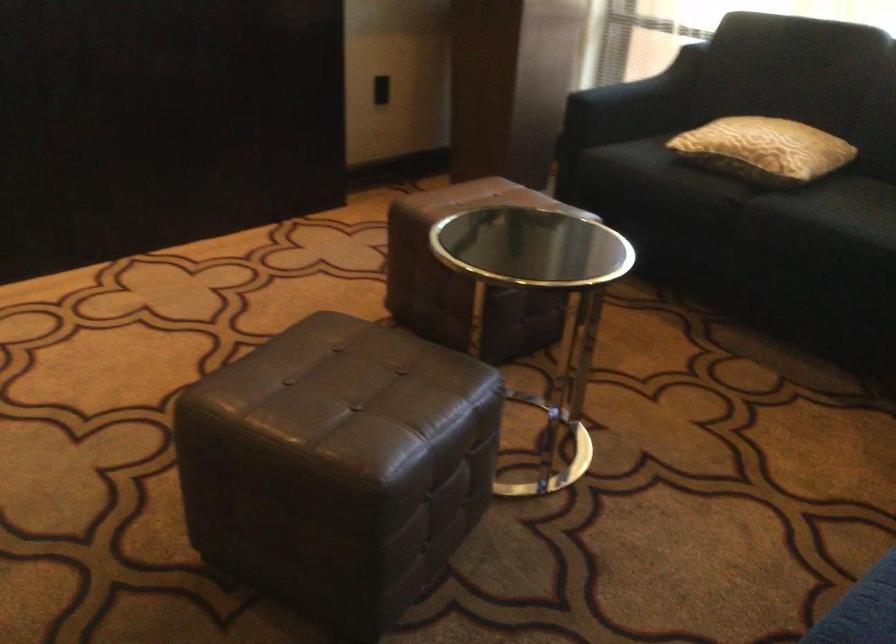
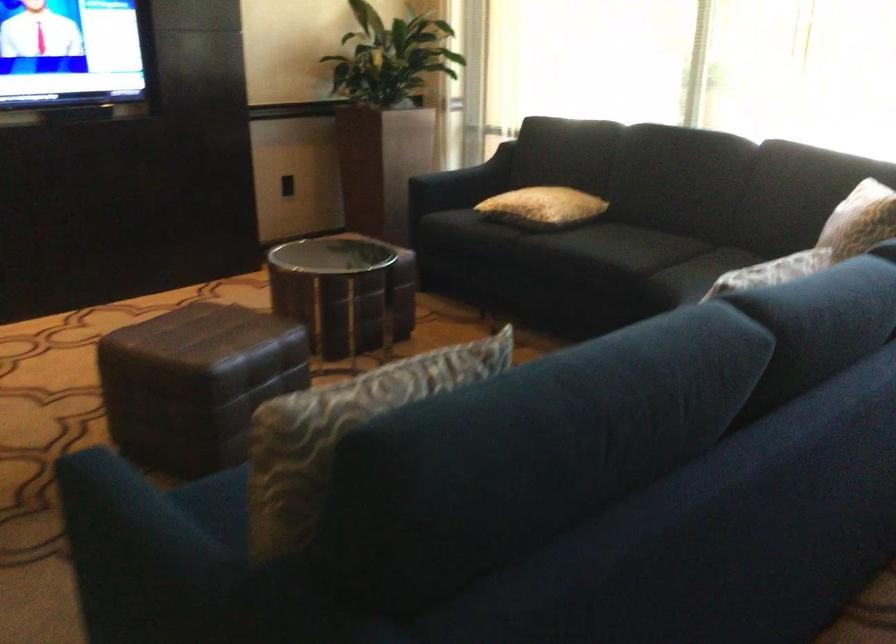
What movement of the cameraman would produce the second image?

The cameraman walked toward right, backward.